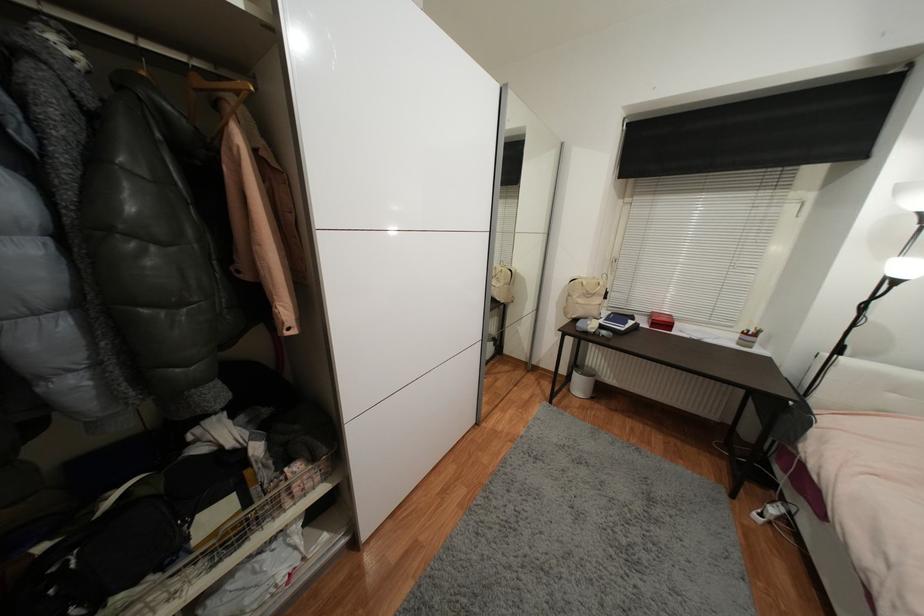
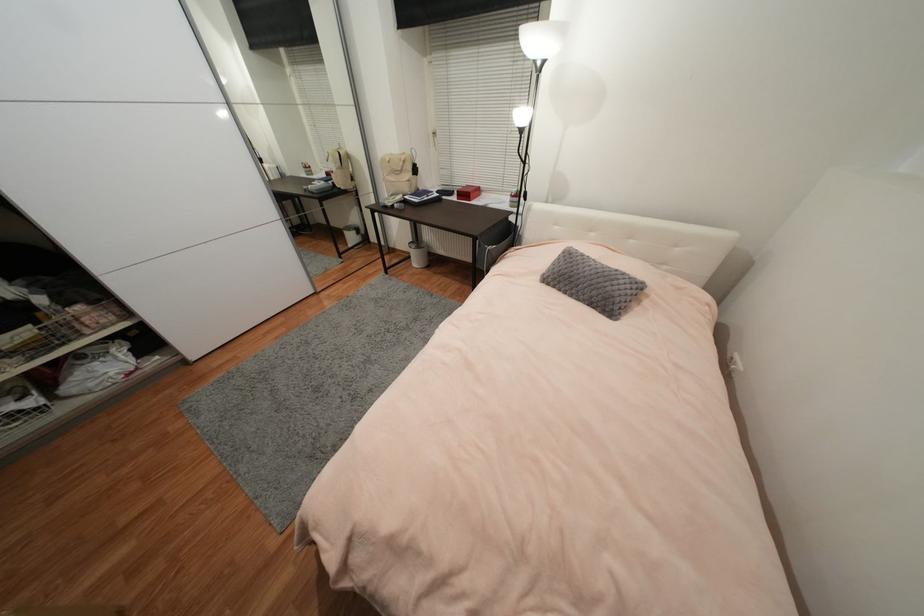
Where in the second image is the point corresponding to [600,315] from the first image?

(410, 191)